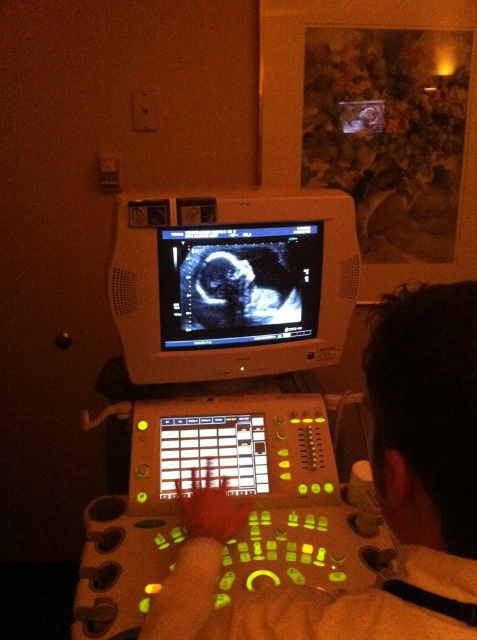
Question: Which object is farther from the camera taking this photo?

Choices:
 (A) skinny white shirt at center
 (B) gray/white ultrasound image at center

Answer: (B)

Question: Which point appears farthest from the camera in this image?

Choices:
 (A) (253, 259)
 (B) (380, 627)

Answer: (A)

Question: From the image, what is the correct spatial relationship of skinny white shirt at center in relation to gray/white ultrasound image at center?

Choices:
 (A) left
 (B) right

Answer: (B)

Question: Which point is closer to the camera?

Choices:
 (A) white glossy monitor at center
 (B) skinny white shirt at center
 (C) gray/white ultrasound image at center

Answer: (B)

Question: Does skinny white shirt at center appear over gray/white ultrasound image at center?

Choices:
 (A) no
 (B) yes

Answer: (A)

Question: Is skinny white shirt at center to the right of gray/white ultrasound image at center from the viewer's perspective?

Choices:
 (A) yes
 (B) no

Answer: (A)